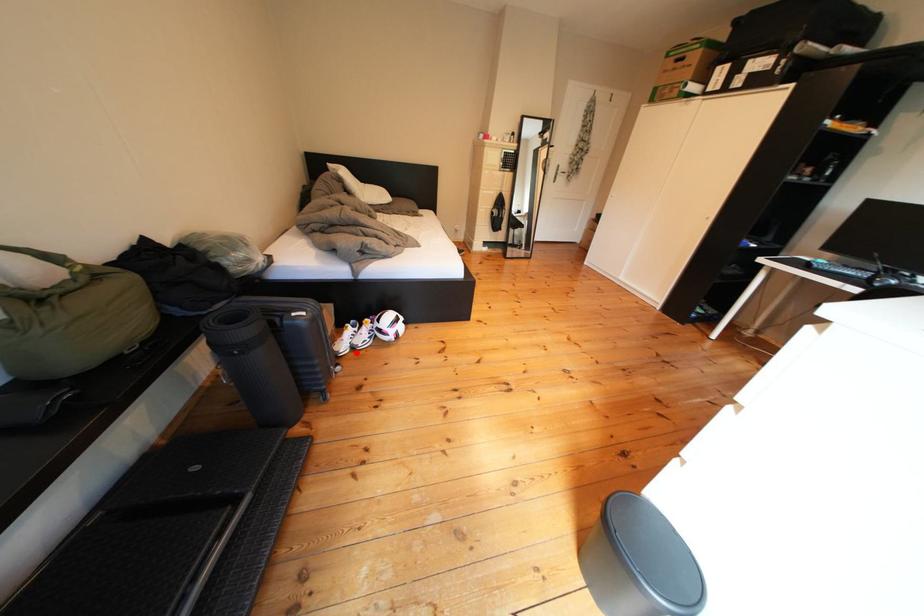
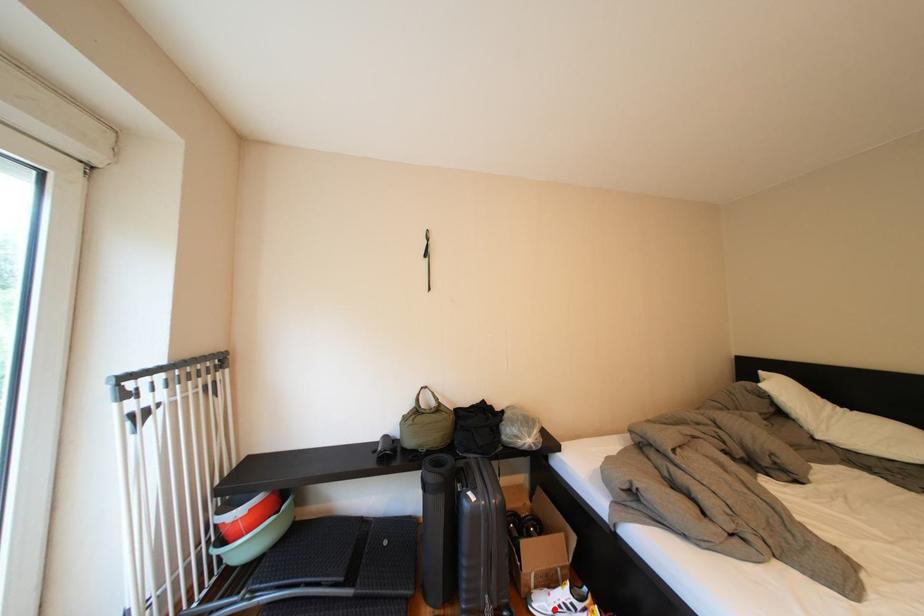
I am providing you with two images of the same scene from different viewpoints. A red point is marked on the first image and another point is marked on the second image. Does the point marked in image1 correspond to the same location as the one in image2?

Yes